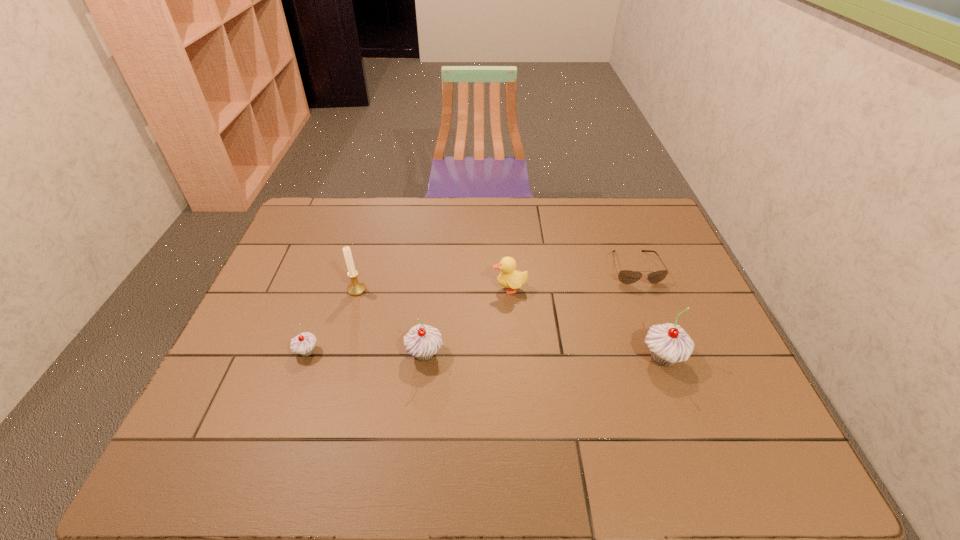
To make them evenly spaced by inserting another cupcake among them, please locate a free space for this new cupcake. Please provide its 2D coordinates. Your answer should be formatted as a tuple, i.e. [(x, y)], where the tuple contains the x and y coordinates of a point satisfying the conditions above.

[(543, 356)]